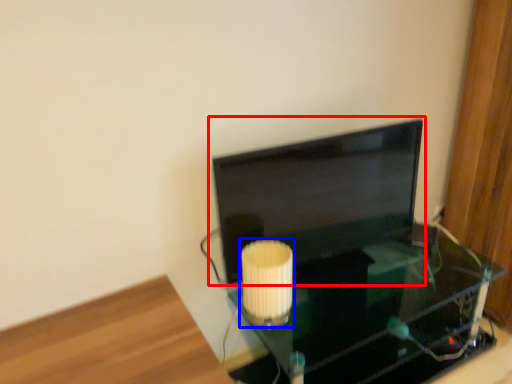
Question: Which object appears farthest to the camera in this image, computer monitor (highlighted by a red box) or lamp (highlighted by a blue box)?

Choices:
 (A) computer monitor
 (B) lamp

Answer: (A)